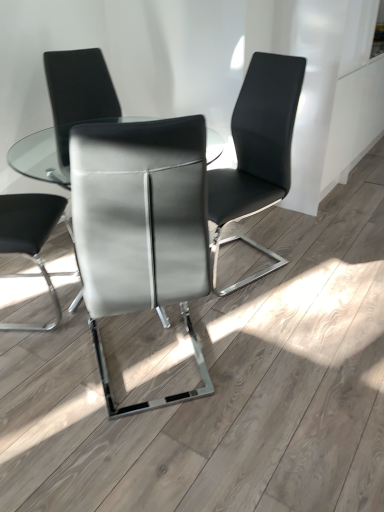
Question: From a real-world perspective, is clear glass table at center on top of sleek leather chair at center, which is the third chair from right to left?

Choices:
 (A) yes
 (B) no

Answer: (B)

Question: Does clear glass table at center lie in front of sleek leather chair at center, placed as the first chair when sorted from left to right?

Choices:
 (A) no
 (B) yes

Answer: (B)

Question: Would you say clear glass table at center contains sleek leather chair at center, placed as the first chair when sorted from left to right?

Choices:
 (A) no
 (B) yes

Answer: (B)

Question: Would you consider clear glass table at center to be distant from sleek leather chair at center, which is the third chair from right to left?

Choices:
 (A) yes
 (B) no

Answer: (B)

Question: Is clear glass table at center to the right of sleek leather chair at center, which is the third chair from right to left, from the viewer's perspective?

Choices:
 (A) yes
 (B) no

Answer: (A)

Question: Looking at the image, does satin gray leather chair at center, placed as the 2th chair when sorted from left to right, seem bigger or smaller compared to matte black chair at center, placed as the 3th chair when sorted from left to right?

Choices:
 (A) small
 (B) big

Answer: (A)

Question: From the image's perspective, relative to matte black chair at center, marked as the 1th chair in a right-to-left arrangement, is satin gray leather chair at center, marked as the second chair in a right-to-left arrangement, above or below?

Choices:
 (A) above
 (B) below

Answer: (B)

Question: Is point (137, 179) positioned closer to the camera than point (244, 199)?

Choices:
 (A) closer
 (B) farther

Answer: (A)

Question: Is satin gray leather chair at center, placed as the 2th chair when sorted from left to right, spatially inside matte black chair at center, placed as the 3th chair when sorted from left to right, or outside of it?

Choices:
 (A) inside
 (B) outside

Answer: (B)

Question: Considering the relative positions of clear glass table at center and sleek leather chair at center, placed as the first chair when sorted from left to right, in the image provided, is clear glass table at center to the left or to the right of sleek leather chair at center, placed as the first chair when sorted from left to right,?

Choices:
 (A) right
 (B) left

Answer: (A)

Question: From the image's perspective, is clear glass table at center above or below sleek leather chair at center, placed as the first chair when sorted from left to right?

Choices:
 (A) below
 (B) above

Answer: (A)

Question: Is clear glass table at center taller or shorter than sleek leather chair at center, placed as the first chair when sorted from left to right?

Choices:
 (A) short
 (B) tall

Answer: (A)

Question: Considering the positions of clear glass table at center and sleek leather chair at center, which is the third chair from right to left, in the image, is clear glass table at center bigger or smaller than sleek leather chair at center, which is the third chair from right to left,?

Choices:
 (A) small
 (B) big

Answer: (B)

Question: Is point (188, 243) closer or farther from the camera than point (77, 298)?

Choices:
 (A) closer
 (B) farther

Answer: (A)

Question: Looking at the image, does satin gray leather chair at center, placed as the 2th chair when sorted from left to right, seem bigger or smaller compared to clear glass table at center?

Choices:
 (A) small
 (B) big

Answer: (A)